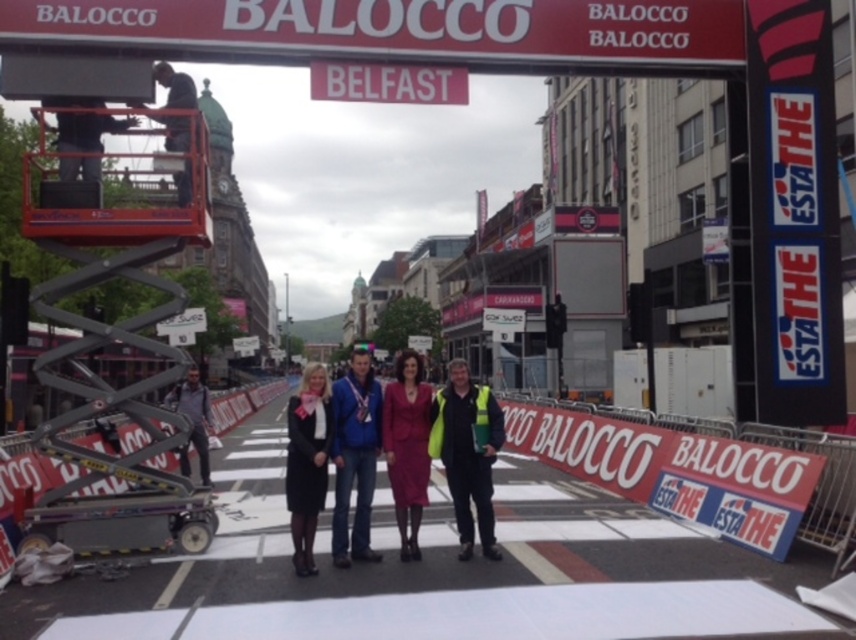
You are standing at the pedestrian crossing in Belfast and want to determine which of the two points, point (337, 538) or point (408, 385), is closer to you. Based on the scene, which point is nearer?

Point (337, 538) is closer to the viewer than point (408, 385).

You are a pedestrian trying to cross the street in Belfast. You see the neon yellow safety vest at center and the black fabric coat at center. Which one is closer to you?

The neon yellow safety vest at center is closer to you because the black fabric coat at center is behind it.

You are a pedestrian trying to cross the street in Belfast. You see a neon yellow safety vest at center. Where is the safety vest positioned relative to the pedestrian crossing area?

The neon yellow safety vest at center is located at point [467,452], which is within the pedestrian crossing area.